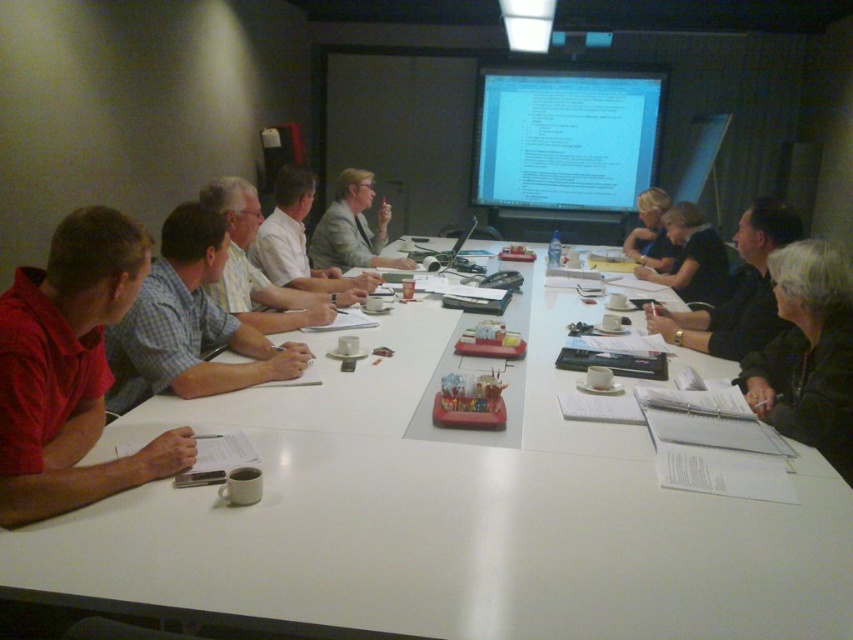
You are a new attendee at the meeting and need to sit down. There is a chair available at the table. The chair is positioned between the black leather jacket at lower right and the black shirt at right. Can you sit in that chair without moving either the jacket or the shirt?

The black leather jacket at lower right and black shirt at right are 17.41 inches apart. Since the chair is between them, and assuming standard chair dimensions, the distance between the jacket and shirt is likely sufficient to allow sitting without moving either item. However, exact feasibility depends on the chair size and placement.

You are a photographer standing at the back of the conference room. You need to take a photo of both the light gray suit at center and the dark gray shirt at center so that both are in focus. The camera you are using has a depth of field that can cover 1.6 meters. Will both subjects be in focus?

The light gray suit at center is 1.63 meters away from the dark gray shirt at center. Since the distance between them is slightly more than the camera can cover with its 1.6 meter depth of field, the subjects might not both be in focus.

You are attending a meeting and want to know if the person wearing the matte white shirt at center can fit into a space that is designed to accommodate the light gray suit at center. Based on their sizes, can they fit?

The matte white shirt at center is thinner than the light gray suit at center, so the person wearing the matte white shirt at center can fit into a space designed for the light gray suit at center.